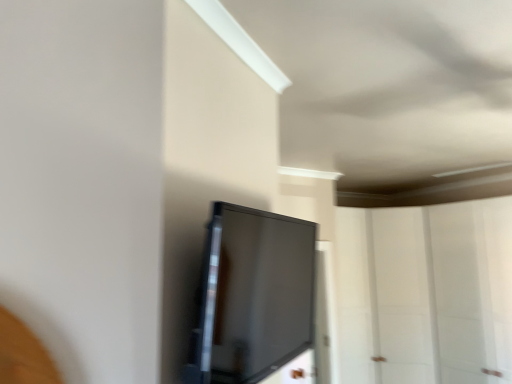
Question: Is the surface of matte black screen at center in direct contact with transparent glass door at center?

Choices:
 (A) no
 (B) yes

Answer: (A)

Question: Can you confirm if matte black screen at center is smaller than transparent glass door at center?

Choices:
 (A) no
 (B) yes

Answer: (B)

Question: Considering the relative sizes of matte black screen at center and transparent glass door at center in the image provided, is matte black screen at center taller than transparent glass door at center?

Choices:
 (A) no
 (B) yes

Answer: (A)

Question: Is transparent glass door at center at the back of matte black screen at center?

Choices:
 (A) yes
 (B) no

Answer: (B)

Question: From a real-world perspective, does matte black screen at center sit lower than transparent glass door at center?

Choices:
 (A) no
 (B) yes

Answer: (A)

Question: Does matte black screen at center have a lesser width compared to transparent glass door at center?

Choices:
 (A) no
 (B) yes

Answer: (B)

Question: Is transparent glass door at center shorter than matte black screen at center?

Choices:
 (A) yes
 (B) no

Answer: (B)

Question: Considering the relative sizes of transparent glass door at center and matte black screen at center in the image provided, is transparent glass door at center wider than matte black screen at center?

Choices:
 (A) yes
 (B) no

Answer: (A)

Question: Is transparent glass door at center closer to the viewer compared to matte black screen at center?

Choices:
 (A) yes
 (B) no

Answer: (B)

Question: Can matte black screen at center be found inside transparent glass door at center?

Choices:
 (A) no
 (B) yes

Answer: (A)

Question: From a real-world perspective, is transparent glass door at center beneath matte black screen at center?

Choices:
 (A) no
 (B) yes

Answer: (B)

Question: Is transparent glass door at center positioned with its back to matte black screen at center?

Choices:
 (A) yes
 (B) no

Answer: (B)

Question: Is matte black screen at center wider or thinner than transparent glass door at center?

Choices:
 (A) wide
 (B) thin

Answer: (B)